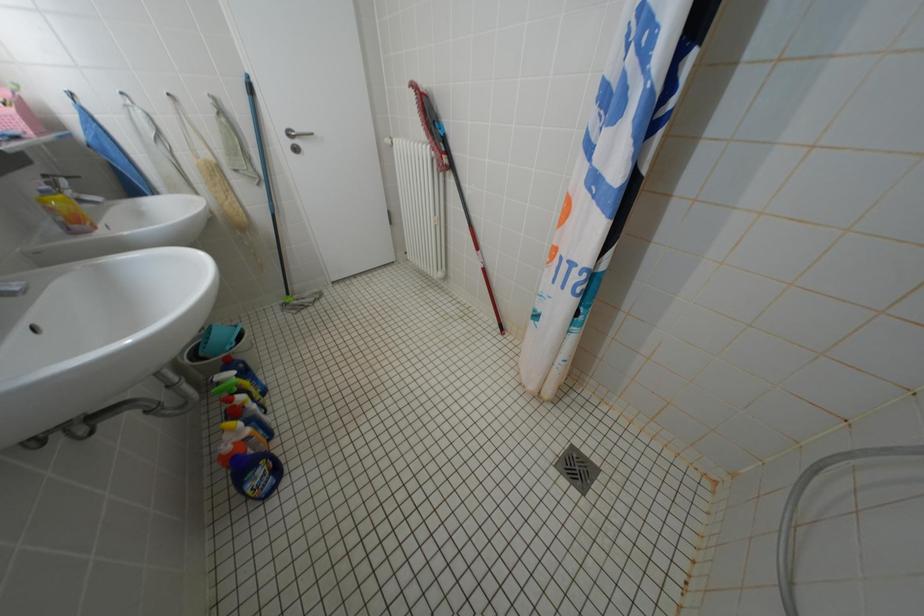
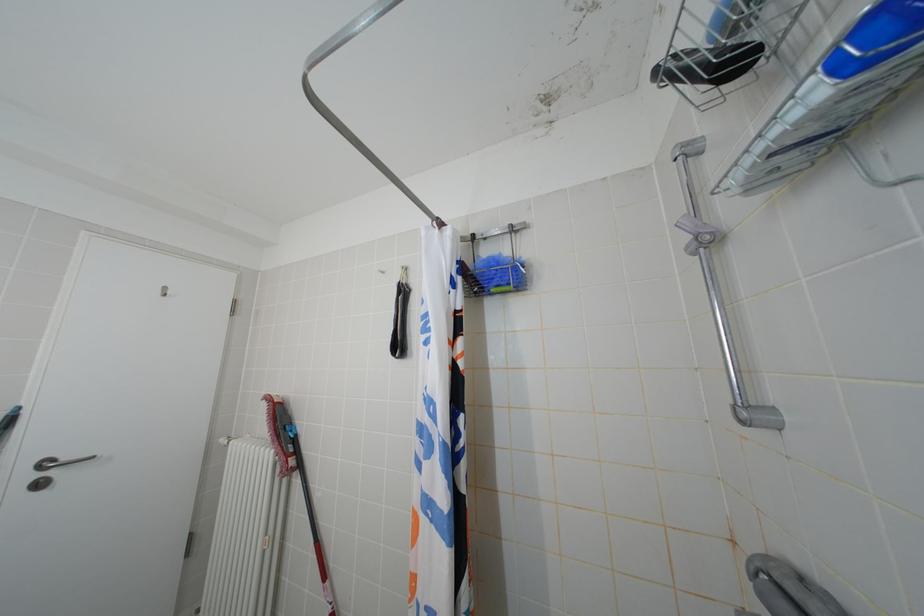
First-person continuous shooting, in which direction is the camera rotating?

The camera rotated toward right-up.